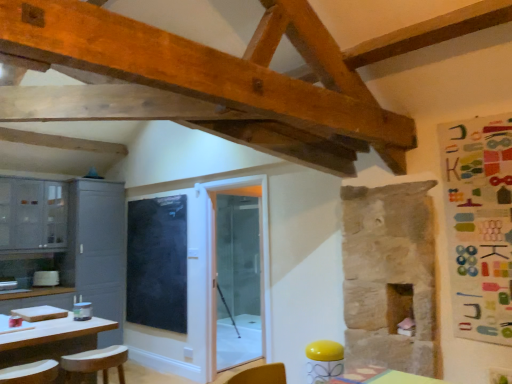
At what (x,y) coordinates should I click in order to perform the action: click on empty space that is ontop of wooden stool at lower left (from a real-world perspective). Please return your answer as a coordinate pair (x, y). This screenshot has height=384, width=512. Looking at the image, I should click on (81, 352).